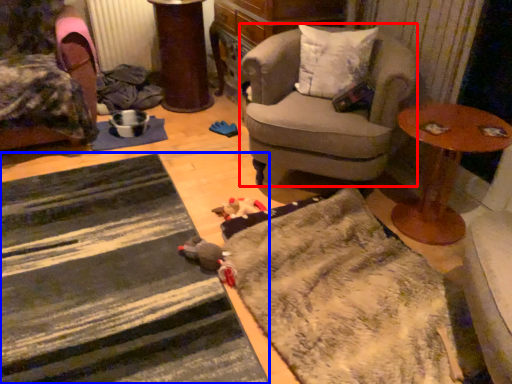
Question: Which point is closer to the camera, chair (highlighted by a red box) or doormat (highlighted by a blue box)?

Choices:
 (A) chair
 (B) doormat

Answer: (B)